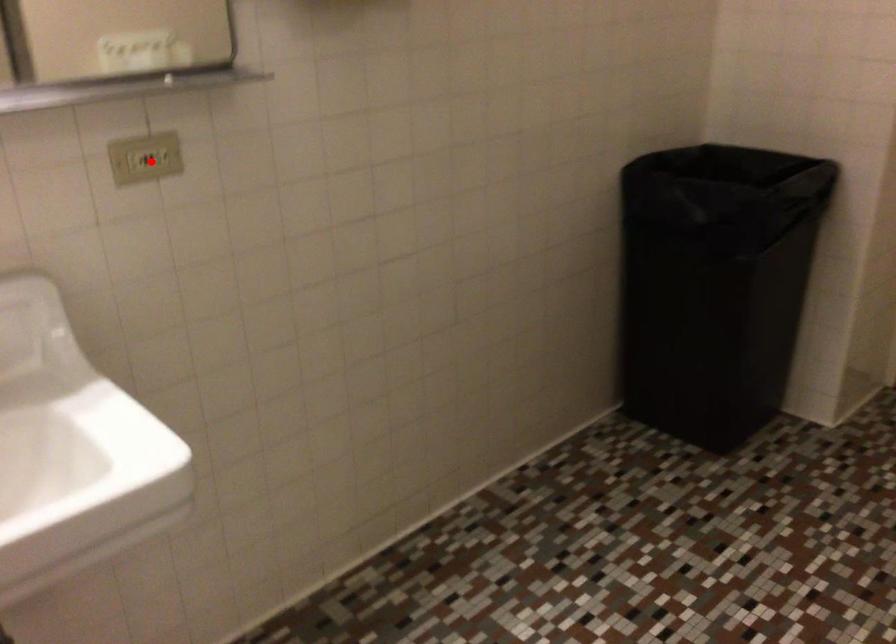
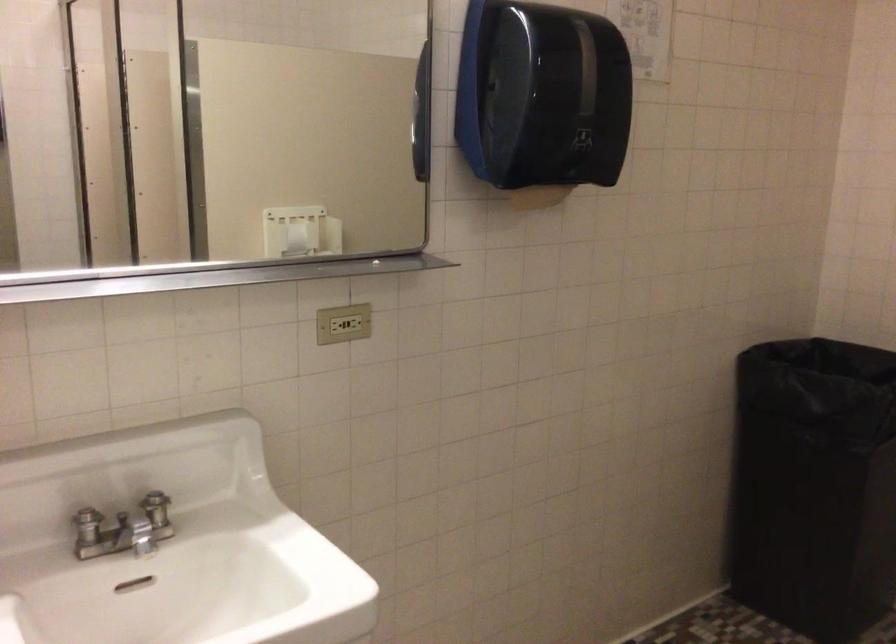
Find the pixel in the second image that matches the highlighted location in the first image.

(342, 323)